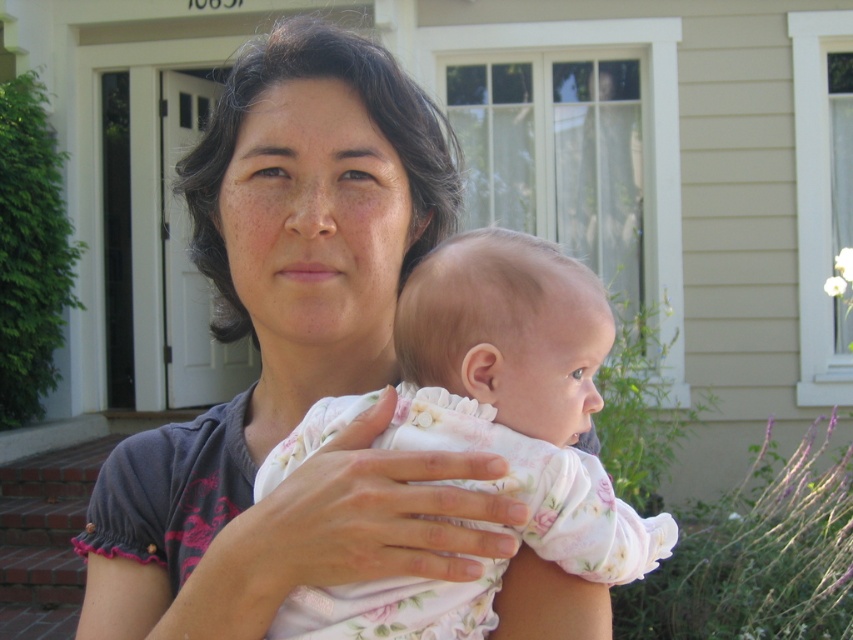
You are a photographer adjusting your camera settings to focus on the matte gray shirt at center and the floral cotton baby at center. Which object should you focus on first to ensure both are in sharp focus?

The matte gray shirt at center is closer to the viewer than the floral cotton baby at center, so you should focus on the matte gray shirt at center first to ensure both are in sharp focus.

You are a photographer setting up for a family portrait. You need to ensure that the matte gray shirt at center and the floral cotton baby at center are both visible in the frame. Based on their positions, which object should you adjust to keep both in the shot?

The matte gray shirt at center is positioned on the left side of floral cotton baby at center. To keep both in the shot, you should adjust the camera angle slightly to the left to ensure the matte gray shirt at center remains visible while keeping the floral cotton baby at center centered.

You are a photographer adjusting the lighting for a portrait. You notice the matte gray shirt at center and the floral cotton baby at center. Which object is closer to the camera?

The matte gray shirt at center is positioned over the floral cotton baby at center, so it is closer to the camera.